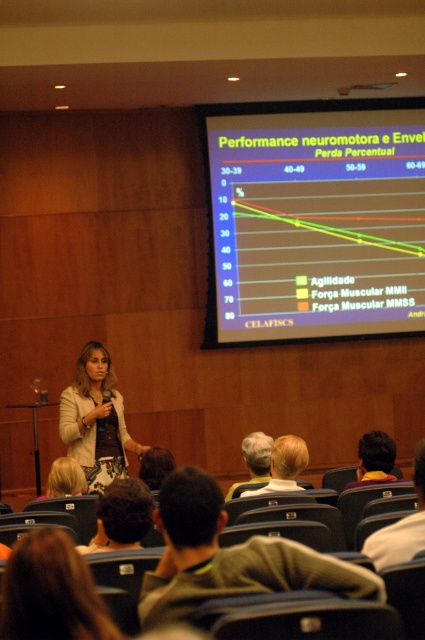
You are an attendee at the presentation and want to take a photo of the graph displayed on the large screen. However, there is a brown fabric shirt at lower center in your line of sight. Based on its position, can you estimate whether the shirt is blocking the graph?

The brown fabric shirt at lower center is positioned at point 0.872 on the x axis and 0.539 on the y axis. Since the graph is displayed on the large screen at the back of the room, which is at the upper part of the image, the shirt is likely below the graph and not blocking it.

From the picture: You are a photographer in the conference room and want to take a photo of the presentation screen. However, there is a person with blonde hair at center blocking your view. Where should you move to avoid the person?

The blonde hair at center is located at point (285, 465). To avoid blocking the view, move to the left or right of the person to capture the screen clearly.